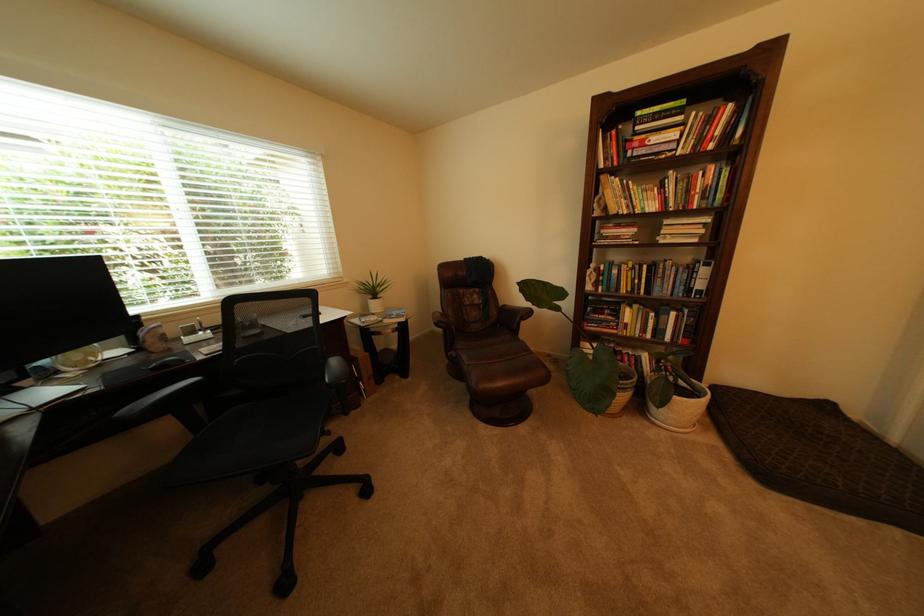
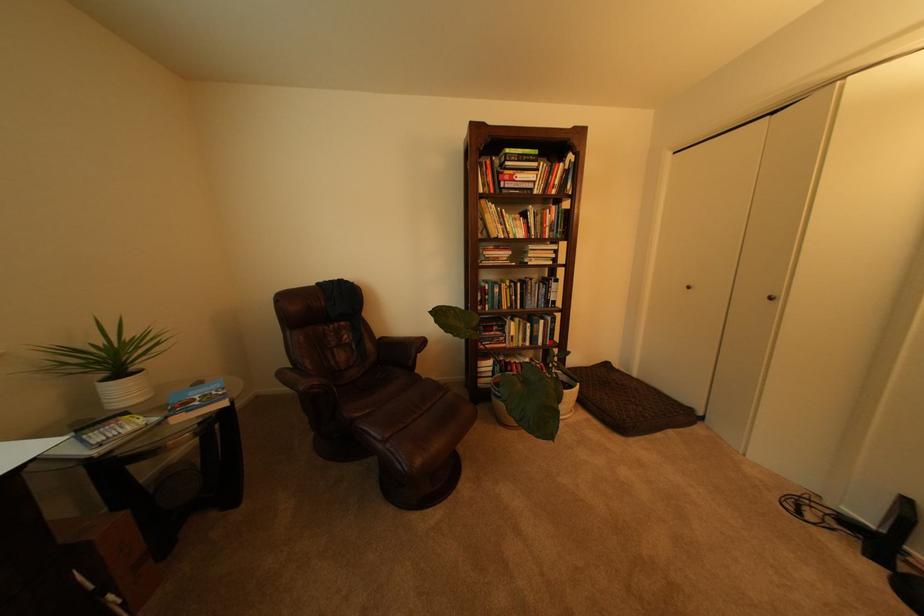
Locate, in the second image, the point that corresponds to (444,315) in the first image.

(290, 374)